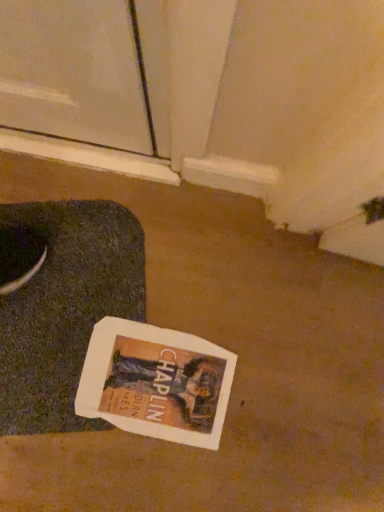
The height and width of the screenshot is (512, 384). Find the location of `free region under white paper magazine at center (from a real-world perspective)`. free region under white paper magazine at center (from a real-world perspective) is located at coordinates (176, 382).